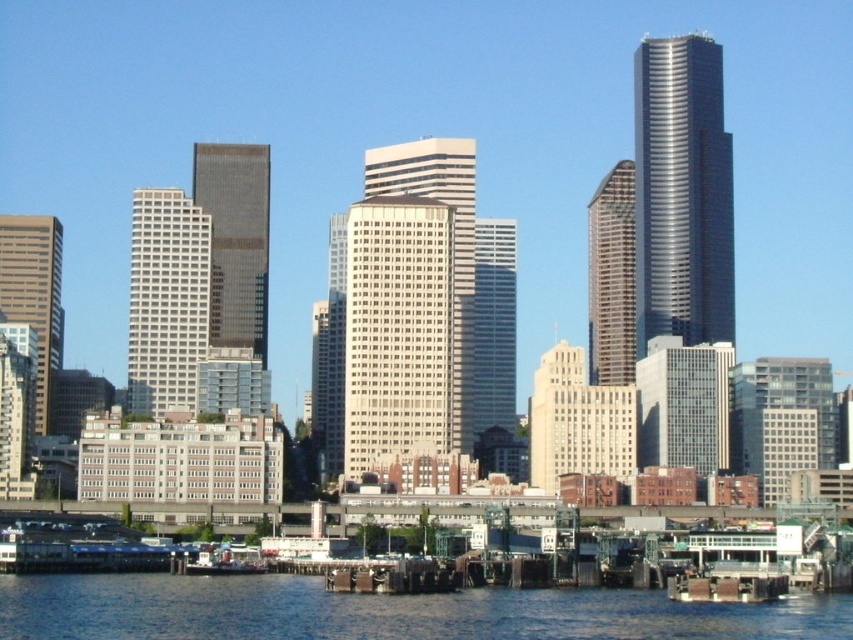
Question: From the image, what is the correct spatial relationship of blue water at lower center in relation to white smooth building at center?

Choices:
 (A) below
 (B) above

Answer: (A)

Question: Which point is closer to the camera?

Choices:
 (A) (163, 268)
 (B) (236, 566)

Answer: (B)

Question: Is blue water at lower center thinner than gray glass skyscraper at center?

Choices:
 (A) no
 (B) yes

Answer: (A)

Question: Which of the following is the closest to the observer?

Choices:
 (A) matte gray building at left
 (B) matte glass skyscraper at center
 (C) metallic gray boat at lower left
 (D) white smooth building at center

Answer: (C)

Question: Does blue water at lower center appear on the left side of dark gray glass skyscraper at center?

Choices:
 (A) yes
 (B) no

Answer: (B)

Question: Which object appears farthest from the camera in this image?

Choices:
 (A) dark gray glass skyscraper at center
 (B) metallic gray boat at lower left
 (C) clear glass skyscraper at center
 (D) gray glass skyscraper at center

Answer: (D)